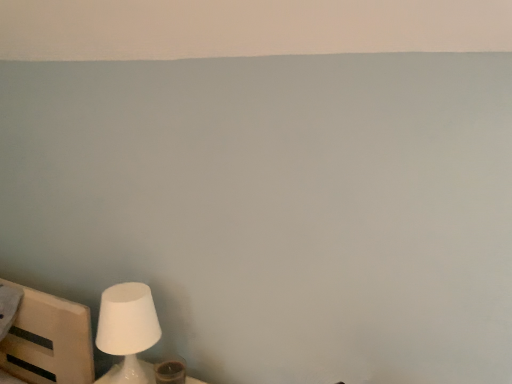
Image resolution: width=512 pixels, height=384 pixels. In order to click on white matte lamp at lower left in this screenshot , I will do `click(127, 331)`.

What do you see at coordinates (127, 331) in the screenshot? I see `white matte lamp at lower left` at bounding box center [127, 331].

Where is `white matte lamp at lower left`? This screenshot has width=512, height=384. white matte lamp at lower left is located at coordinates (127, 331).